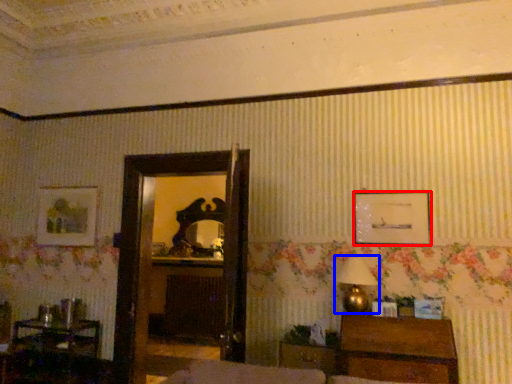
Question: Among these objects, which one is farthest to the camera, picture frame (highlighted by a red box) or table lamp (highlighted by a blue box)?

Choices:
 (A) picture frame
 (B) table lamp

Answer: (A)